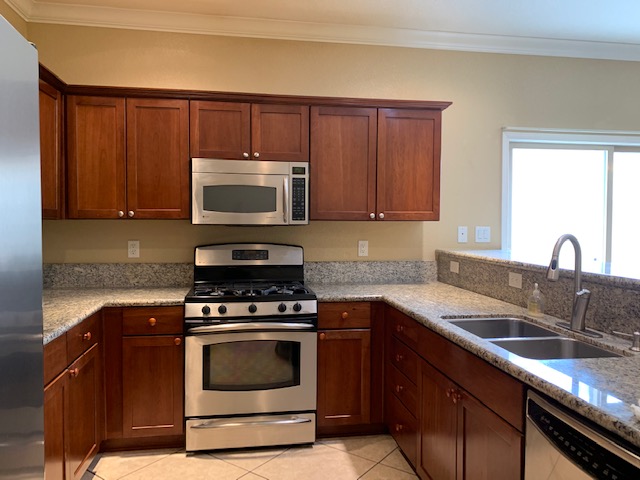
Find the location of a particular element. stove top is located at coordinates (202, 286), (276, 290).